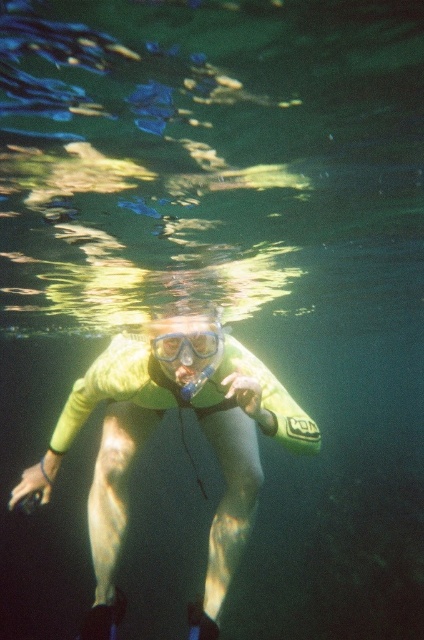
You are a lifeguard observing a snorkeler in the water. You notice the yellow neoprene wetsuit at center and the clear plastic goggles at center. Which object is positioned to the right side of the other?

The yellow neoprene wetsuit at center is to the left of clear plastic goggles at center, so the clear plastic goggles at center are positioned to the right side of the yellow neoprene wetsuit at center.

You are a diver preparing to take a photo of the snorkeler wearing a yellow wetsuit with the brand RON on the sleeve. The point of interest is at coordinates point (265, 394). If your camera has a maximum focus range of 4 meters, will you be able to capture the point of interest clearly?

The distance of point (265, 394) from the camera is 4.61 meters, which exceeds the camera maximum focus range of 4 meters. Therefore, the point of interest will be out of focus and not captured clearly.

You are a lifeguard on duty and notice a snorkeler in the water. You need to determine if their equipment is properly positioned. Based on the scene, is the yellow neoprene wetsuit at center covering the clear plastic goggles at center?

The yellow neoprene wetsuit at center is below clear plastic goggles at center, so the wetsuit is not covering the goggles. The goggles are positioned above the wetsuit, which means they are properly placed on the snorkeler.